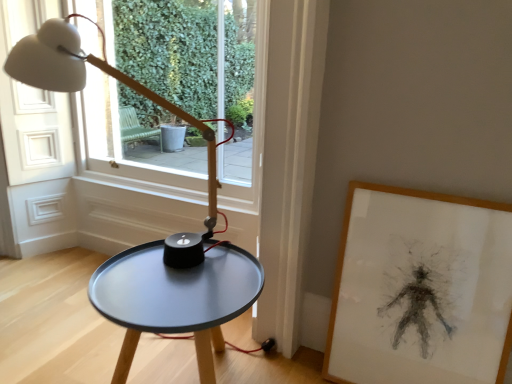
What is the approximate height of wooden framed drawing at right?

The height of wooden framed drawing at right is 30.06 inches.

What do you see at coordinates (175, 298) in the screenshot? I see `matte black table at center` at bounding box center [175, 298].

This screenshot has width=512, height=384. Find the location of `wooden framed drawing at right`. wooden framed drawing at right is located at coordinates (421, 289).

From a real-world perspective, which object stands above the other?

transparent glass window at upper center, from a real-world perspective.

Identify the location of picture frame below the transparent glass window at upper center (from the image's perspective). The width and height of the screenshot is (512, 384). (421, 289).

Which of these two, wooden framed drawing at right or transparent glass window at upper center, is smaller?

With smaller size is wooden framed drawing at right.

Considering the sizes of objects wooden framed drawing at right and matte black table at center in the image provided, who is bigger, wooden framed drawing at right or matte black table at center?

matte black table at center.

Is wooden framed drawing at right oriented away from matte black table at center?

That's not correct — wooden framed drawing at right is not looking away from matte black table at center.

How different are the orientations of wooden framed drawing at right and matte black table at center in degrees?

wooden framed drawing at right and matte black table at center are facing 0.931 degrees away from each other.

Does wooden framed drawing at right have a lesser width compared to matte black table at center?

Correct, the width of wooden framed drawing at right is less than that of matte black table at center.

Is transparent glass window at upper center located outside matte black table at center?

Yes, transparent glass window at upper center is outside of matte black table at center.

Considering the relative sizes of transparent glass window at upper center and matte black table at center in the image provided, is transparent glass window at upper center smaller than matte black table at center?

Incorrect, transparent glass window at upper center is not smaller in size than matte black table at center.

Is there a large distance between transparent glass window at upper center and matte black table at center?

transparent glass window at upper center is actually quite close to matte black table at center.

Is transparent glass window at upper center positioned with its back to matte black table at center?

No, transparent glass window at upper center is not facing away from matte black table at center.

Can you confirm if matte black table at center is positioned to the left of wooden framed drawing at right?

Indeed, matte black table at center is positioned on the left side of wooden framed drawing at right.

Which of these two, matte black table at center or wooden framed drawing at right, is bigger?

matte black table at center.

From a real-world perspective, is matte black table at center beneath wooden framed drawing at right?

Yes.

Does matte black table at center come behind wooden framed drawing at right?

No, matte black table at center is closer to the camera.

Does transparent glass window at upper center have a lesser height compared to wooden framed drawing at right?

No.

How different are the orientations of transparent glass window at upper center and wooden framed drawing at right in degrees?

The angular difference between transparent glass window at upper center and wooden framed drawing at right is 0.6 degrees.

Considering the points (170, 154) and (400, 352), which point is behind, point (170, 154) or point (400, 352)?

Positioned behind is point (170, 154).

Is transparent glass window at upper center thinner than wooden framed drawing at right?

No.

Do you think matte black table at center is within transparent glass window at upper center, or outside of it?

matte black table at center is not enclosed by transparent glass window at upper center.

Which of these two, matte black table at center or transparent glass window at upper center, is wider?

matte black table at center is wider.

Between matte black table at center and transparent glass window at upper center, which one has less height?

matte black table at center.

Where is `window above the wooden framed drawing at right (from the image's perspective)`? This screenshot has height=384, width=512. window above the wooden framed drawing at right (from the image's perspective) is located at coordinates (134, 145).

Where is `picture frame behind the matte black table at center`? picture frame behind the matte black table at center is located at coordinates (421, 289).

When comparing their distances from transparent glass window at upper center, does wooden framed drawing at right or matte black table at center seem closer?

Based on the image, matte black table at center appears to be nearer to transparent glass window at upper center.

From the image, which object appears to be nearer to matte black table at center, wooden framed drawing at right or transparent glass window at upper center?

wooden framed drawing at right.

Looking at the image, which one is located closer to wooden framed drawing at right, transparent glass window at upper center or matte black table at center?

The object closer to wooden framed drawing at right is matte black table at center.

From the picture: Looking at the image, which one is located further to transparent glass window at upper center, matte black table at center or wooden framed drawing at right?

wooden framed drawing at right lies further to transparent glass window at upper center than the other object.

Looking at this image, estimate the real-world distances between objects in this image. Which object is closer to wooden framed drawing at right, matte black table at center or transparent glass window at upper center?

Based on the image, matte black table at center appears to be nearer to wooden framed drawing at right.

Which object lies further to the anchor point matte black table at center, transparent glass window at upper center or wooden framed drawing at right?

transparent glass window at upper center is positioned further to the anchor matte black table at center.

Where is `picture frame that lies between transparent glass window at upper center and matte black table at center from top to bottom`? Image resolution: width=512 pixels, height=384 pixels. picture frame that lies between transparent glass window at upper center and matte black table at center from top to bottom is located at coordinates (421, 289).